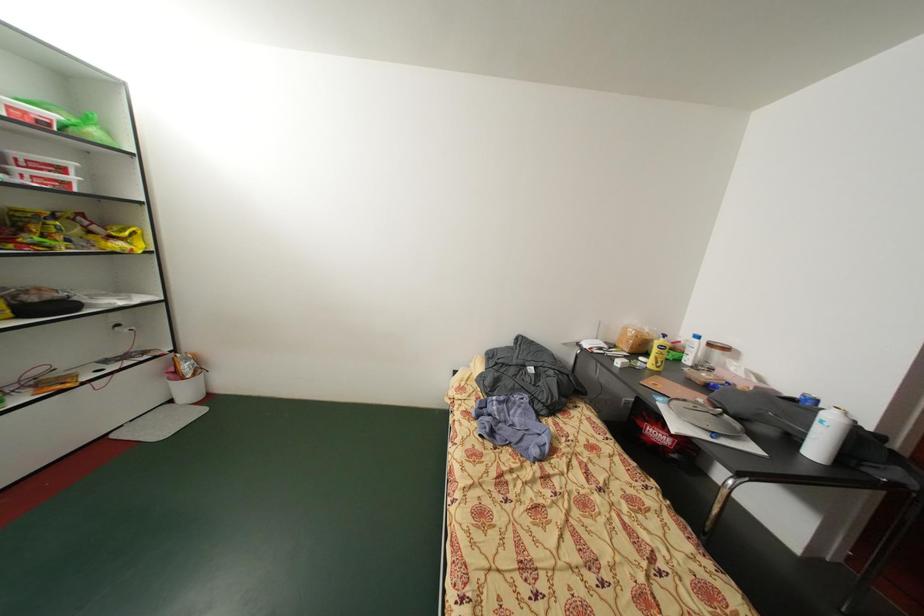
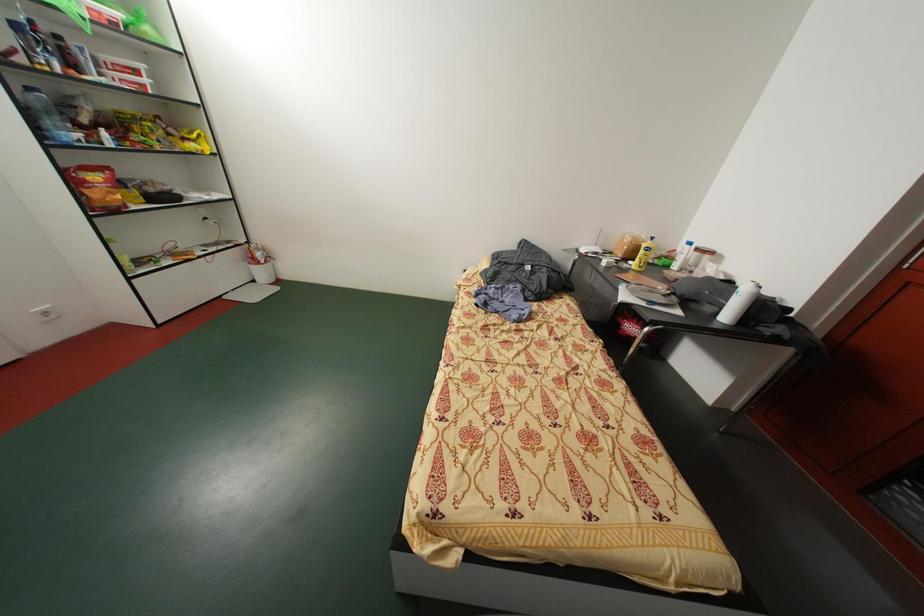
Question: The images are taken continuously from a first-person perspective. In which direction is your viewpoint rotating?

Choices:
 (A) Left
 (B) Right
 (C) Up
 (D) Down

Answer: (D)